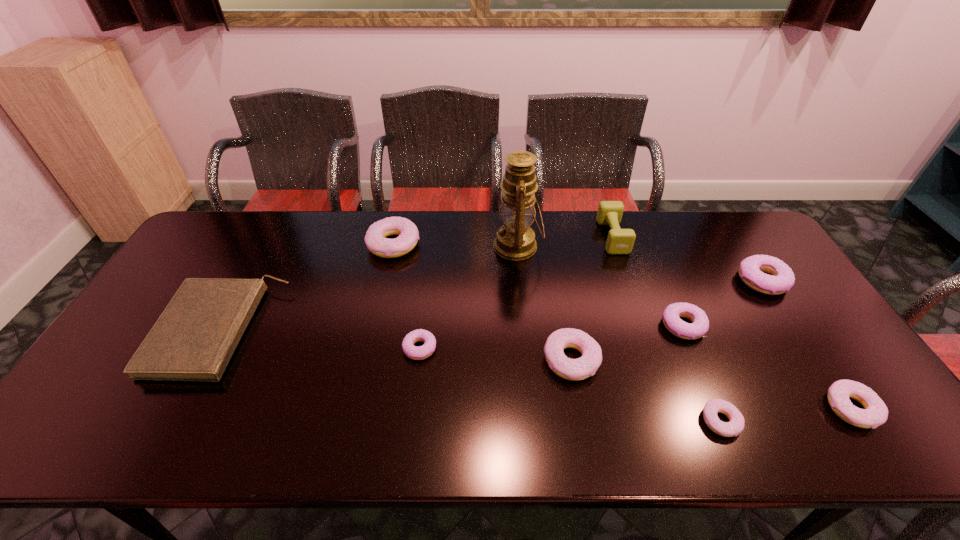
The width and height of the screenshot is (960, 540). What are the coordinates of `oil lamp` in the screenshot? It's located at (515, 240).

Find the location of a particular element. This screenshot has height=540, width=960. dumbbell is located at coordinates (619, 241).

Identify the location of the second tallest object. This screenshot has width=960, height=540. (619, 241).

The image size is (960, 540). What are the coordinates of `the biggest pink doughnut` in the screenshot? It's located at (375, 239).

Identify the location of the farthest pink doughnut. (375, 239).

You are a GUI agent. You are given a task and a screenshot of the screen. Output one action in this format:
    pyautogui.click(x=<x>, y=<y>)
    Task: Click on the sixth nearest doughnut
    This screenshot has width=960, height=540.
    Given the screenshot: What is the action you would take?
    pyautogui.click(x=766, y=274)

This screenshot has width=960, height=540. I want to click on the farthest purple doughnut, so click(x=766, y=274).

At what (x,y) coordinates should I click in order to perform the action: click on the leftmost object. Please return your answer as a coordinate pair (x, y). This screenshot has width=960, height=540. Looking at the image, I should click on (195, 337).

In order to click on the third doughnut from left to right in this screenshot , I will do `click(581, 368)`.

Locate an element on the screen. The image size is (960, 540). the third smallest pink doughnut is located at coordinates (581, 368).